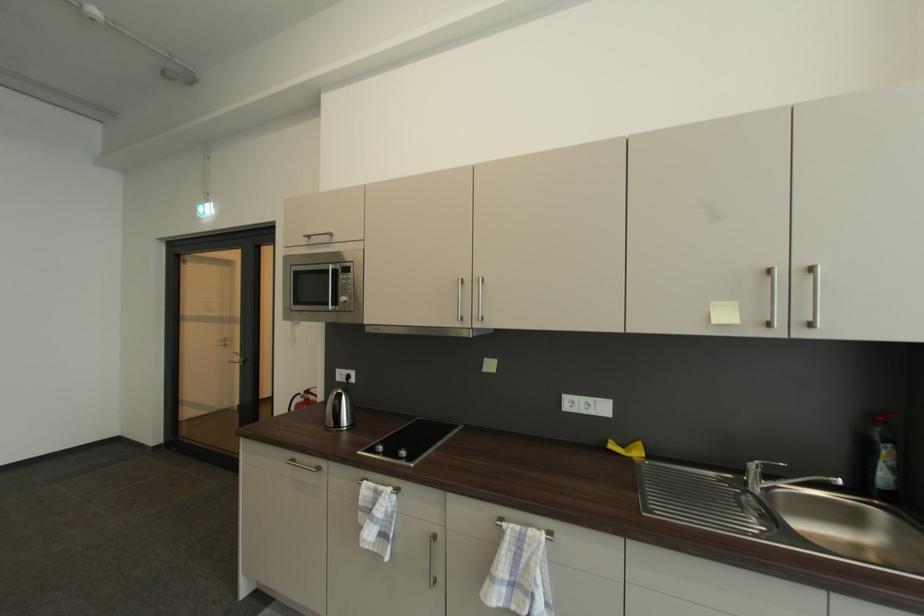
The location [627,448] corresponds to which object?

This point indicates the yellow sponge.